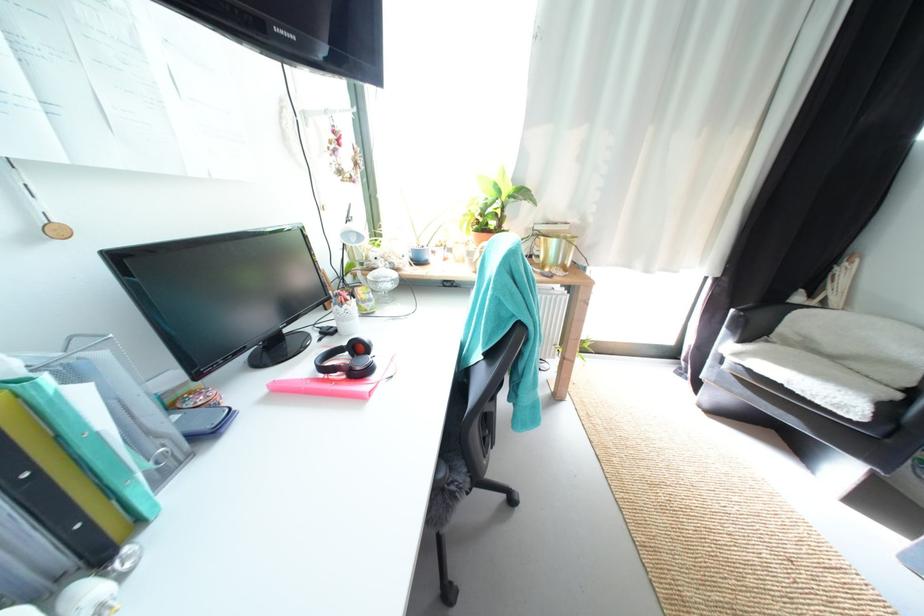
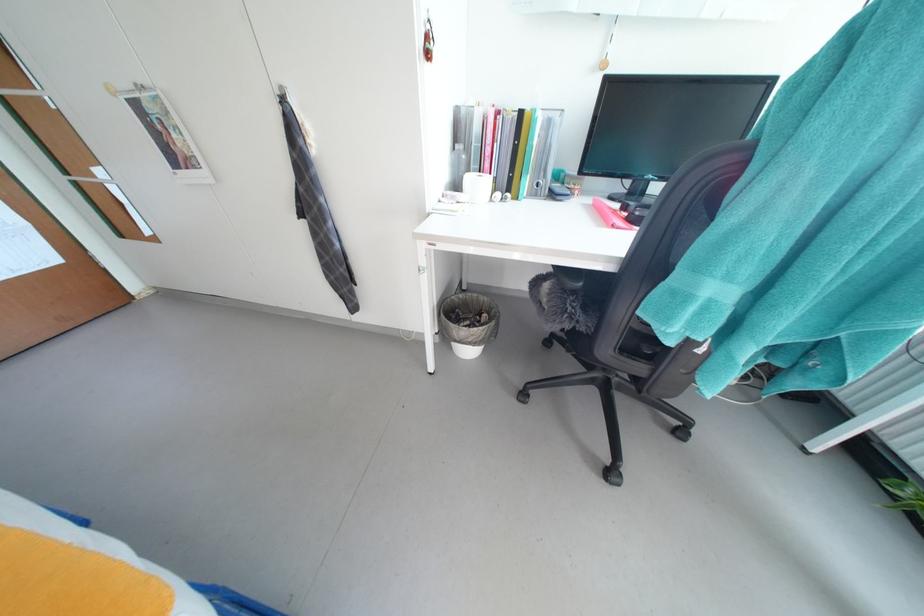
Based on the continuous images, in which direction is the camera rotating?

The camera rotated toward left-down.